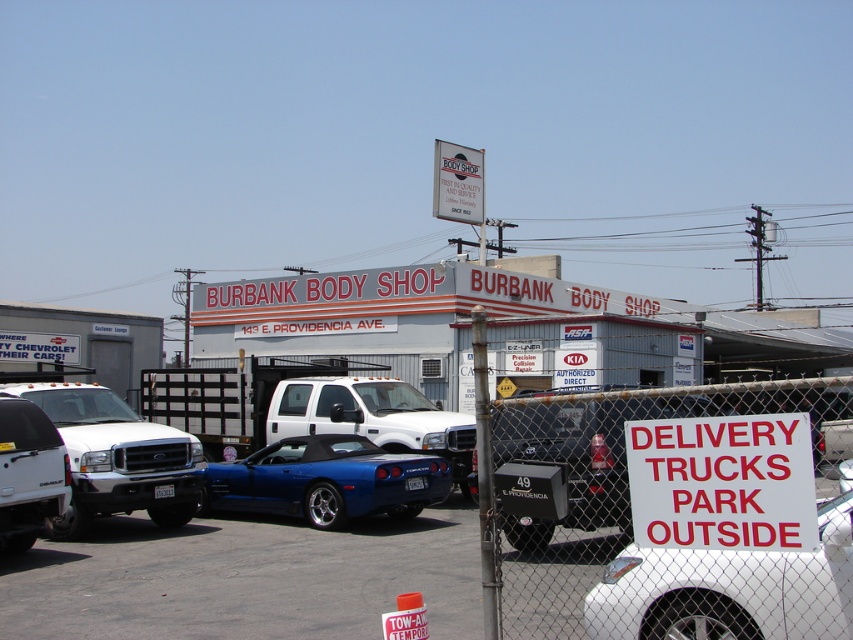
You are a customer arriving at the Burbank Body Shop and need to park your car. You see a white glossy car at lower right and a white matte truck at left. Which vehicle is closer to the entrance of the shop?

The white glossy car at lower right is closer to the entrance of the shop because it is in front of the white matte truck at left, indicating it is positioned nearer to the entrance.

You are a delivery driver who needs to park your vehicle between the white glossy car at lower right and the white matte truck at left. Your delivery van is 2.5 meters wide. Can you fit your van between them?

The white glossy car at lower right has a lesser width compared to white matte truck at left, so the space between them may be sufficient for your 2.5 meter wide van. However, without knowing the exact distance between the vehicles, it is uncertain if there is enough space. Check the actual gap before attempting to park.

You are a delivery driver who needs to park your truck between the white glossy car at lower right and the white plastic sign at lower right. The truck requires 16 inches of space to park safely. Can you fit your truck in that space?

The white glossy car at lower right is 15.75 inches from the white plastic sign at lower right. Since the required space is 16 inches, which is slightly more than the available 15.75 inches, the truck cannot fit safely in that space.